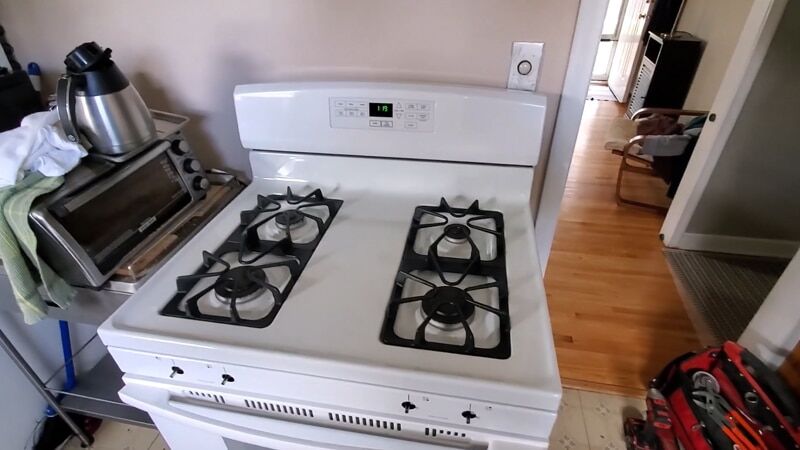
Find the location of a particular element. This screenshot has height=450, width=800. oven is located at coordinates (190, 443), (130, 204).